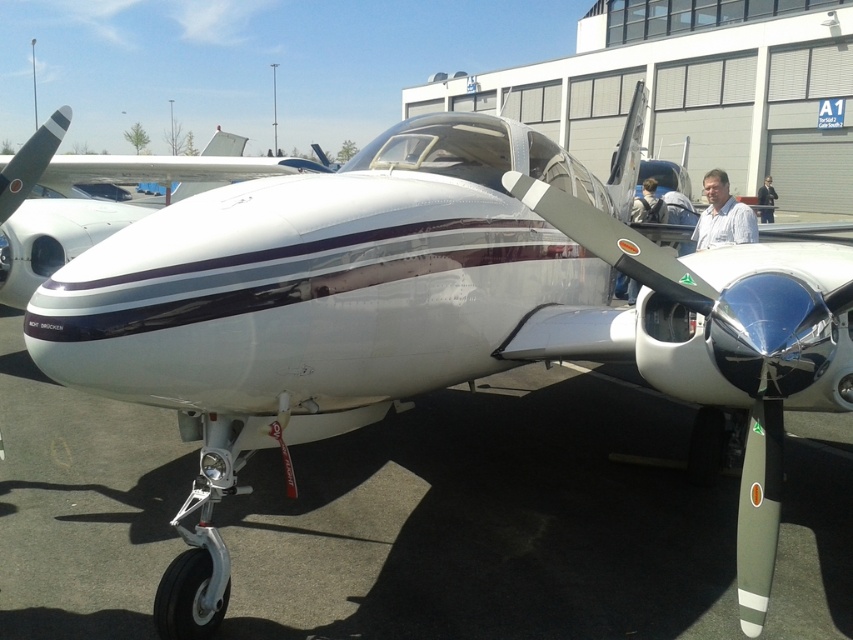
Question: Which point is closer to the camera?

Choices:
 (A) matte black backpack at center
 (B) polished silver propeller at center

Answer: (B)

Question: Can you confirm if white shirt at center is wider than matte black backpack at center?

Choices:
 (A) no
 (B) yes

Answer: (B)

Question: Can you confirm if polished silver propeller at center is thinner than black fabric jacket at center?

Choices:
 (A) no
 (B) yes

Answer: (B)

Question: Among these objects, which one is farthest from the camera?

Choices:
 (A) white shirt at center
 (B) matte black backpack at center
 (C) white glossy airplane at center

Answer: (B)

Question: Is polished silver propeller at center to the left of matte black backpack at center from the viewer's perspective?

Choices:
 (A) yes
 (B) no

Answer: (A)

Question: Estimate the real-world distances between objects in this image. Which object is farther from the black fabric jacket at center?

Choices:
 (A) white glossy airplane at center
 (B) polished silver propeller at center
 (C) matte black backpack at center

Answer: (B)